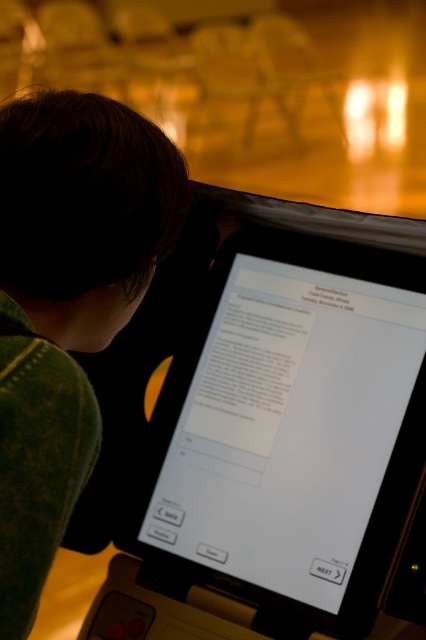
You are trying to locate the white glossy screen at center in the image. According to the coordinates provided, where exactly is it positioned?

The white glossy screen at center is located at point coordinates of (284, 445).

You are designing a poster and need to know the relative sizes of the objects in the image. Which object is bigger, the white glossy screen at center or the green textured sweater at upper left?

The white glossy screen at center has a larger size compared to the green textured sweater at upper left, so the white glossy screen at center is bigger.

You are trying to locate the white glossy screen at center and the green textured sweater at upper left in the scene. Based on their positions, which object is closer to the right side of the image?

The white glossy screen at center is closer to the right side of the image because it is positioned to the right of the green textured sweater at upper left.